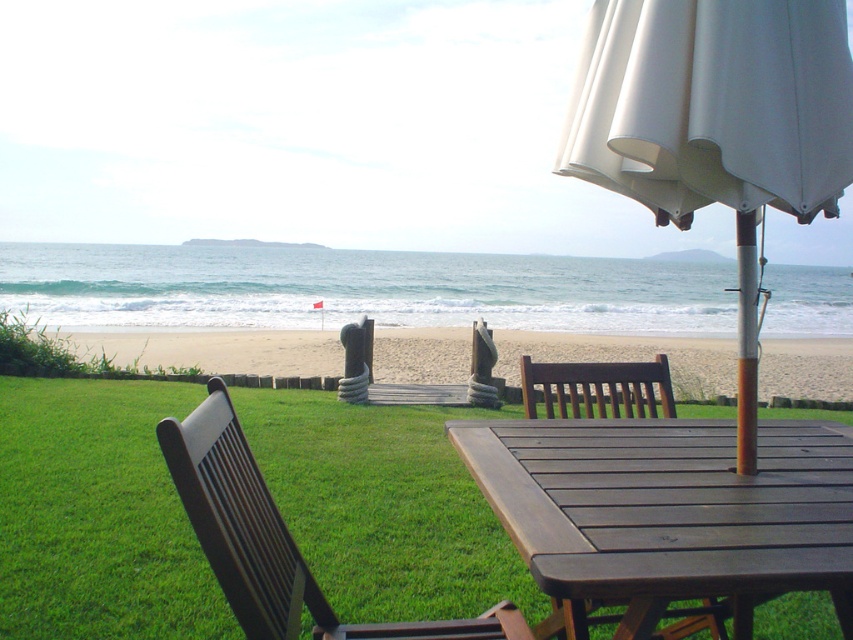
You are planning to set up a new table and chair set on the beach. You have a table that is the same size as the dark brown wood chair at center. Will the white fabric umbrella at upper right be wide enough to provide shade for both the table and the chair?

The white fabric umbrella at upper right is wider than the dark brown wood chair at center. Since the table is the same size as the chair, the umbrella should provide sufficient shade for both the table and the chair.